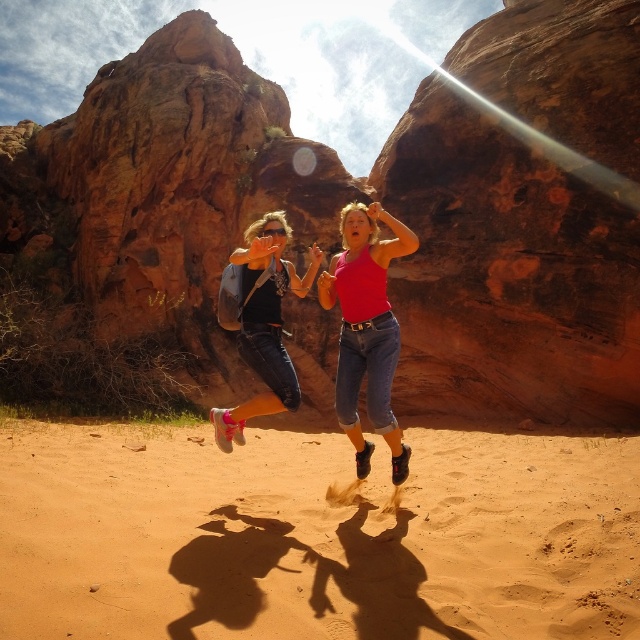
Question: Is matte pink tank top at center thinner than denim jeans at center?

Choices:
 (A) no
 (B) yes

Answer: (B)

Question: Does rustic sandstone rock formation at center have a greater width compared to denim jeans at center?

Choices:
 (A) no
 (B) yes

Answer: (B)

Question: Which of the following is the closest to the observer?

Choices:
 (A) sandy yellow sand at center
 (B) matte pink tank top at center
 (C) denim jeans at center
 (D) rustic sandstone rock formation at center

Answer: (A)

Question: Does sandy yellow sand at center appear over matte pink tank top at center?

Choices:
 (A) yes
 (B) no

Answer: (B)

Question: Which of the following is the farthest from the observer?

Choices:
 (A) matte pink tank top at center
 (B) sandy yellow sand at center
 (C) denim jeans at center
 (D) rustic sandstone rock formation at center

Answer: (D)

Question: Which object is positioned farthest from the rustic sandstone rock formation at center?

Choices:
 (A) sandy yellow sand at center
 (B) denim jeans at center
 (C) matte pink tank top at center

Answer: (A)